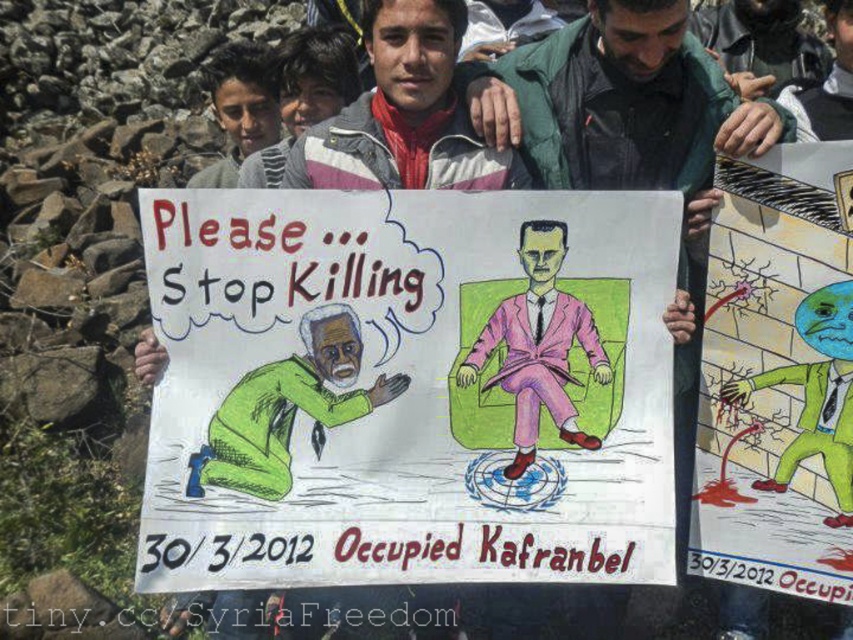
Question: Among these points, which one is farthest from the camera?

Choices:
 (A) (511, 390)
 (B) (352, 323)
 (C) (805, 125)

Answer: (C)

Question: Which point is farther to the camera?

Choices:
 (A) green rubber glove at lower right
 (B) green rubber suit at center
 (C) green fabric shirt at center

Answer: (C)

Question: Is green rubber suit at center smaller than green fabric figure at lower left?

Choices:
 (A) yes
 (B) no

Answer: (B)

Question: Among these objects, which one is farthest from the camera?

Choices:
 (A) green fabric figure at lower left
 (B) matte paper poster at center
 (C) green rubber suit at center

Answer: (C)

Question: Does green rubber suit at center have a greater width compared to green fabric figure at lower left?

Choices:
 (A) no
 (B) yes

Answer: (A)

Question: Does striped fleece jacket at center have a lesser width compared to pink fabric suit at center?

Choices:
 (A) no
 (B) yes

Answer: (A)